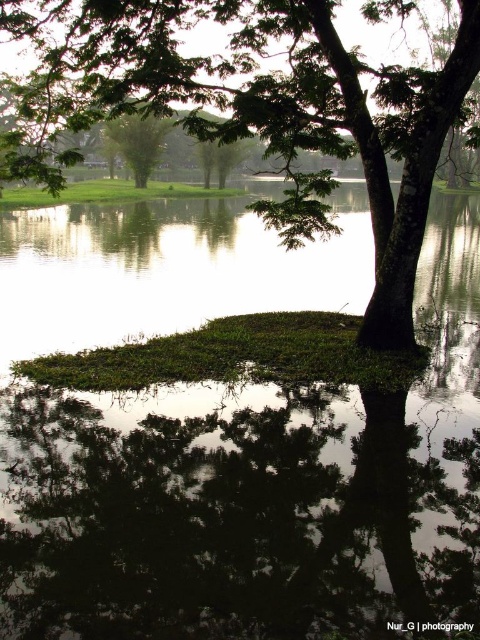
Is green leafy tree at center shorter than green leafy tree at upper left?

Correct, green leafy tree at center is not as tall as green leafy tree at upper left.

The height and width of the screenshot is (640, 480). I want to click on green leafy tree at center, so click(267, 108).